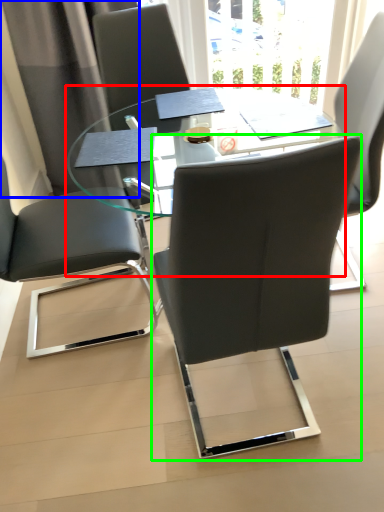
Question: Estimate the real-world distances between objects in this image. Which object is closer to table (highlighted by a red box), curtain (highlighted by a blue box) or chair (highlighted by a green box)?

Choices:
 (A) curtain
 (B) chair

Answer: (A)